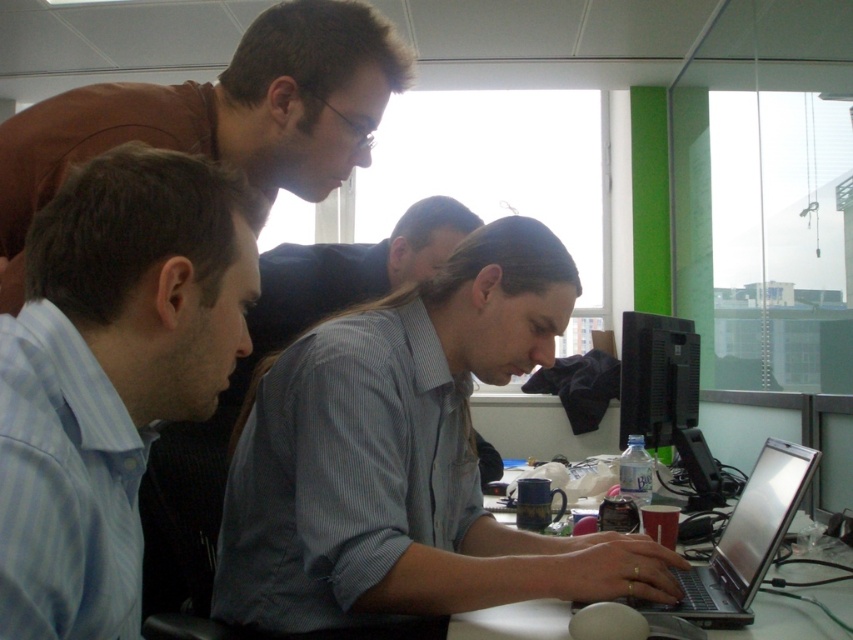
Question: Can you confirm if light blue striped shirt at center is thinner than silver metallic laptop at center?

Choices:
 (A) no
 (B) yes

Answer: (A)

Question: Can you confirm if brown matte shirt at upper left is positioned to the right of light blue striped shirt at center?

Choices:
 (A) yes
 (B) no

Answer: (A)

Question: Is light blue striped shirt at center to the left of white plastic table at center from the viewer's perspective?

Choices:
 (A) yes
 (B) no

Answer: (A)

Question: Which of the following is the farthest from the observer?

Choices:
 (A) black glossy monitor at right
 (B) brown matte shirt at upper left

Answer: (A)

Question: Which of the following is the farthest from the observer?

Choices:
 (A) (728, 576)
 (B) (792, 621)

Answer: (A)

Question: Which point is farther to the camera?

Choices:
 (A) black glossy monitor at right
 (B) light blue striped shirt at center
 (C) brown matte shirt at upper left

Answer: (A)